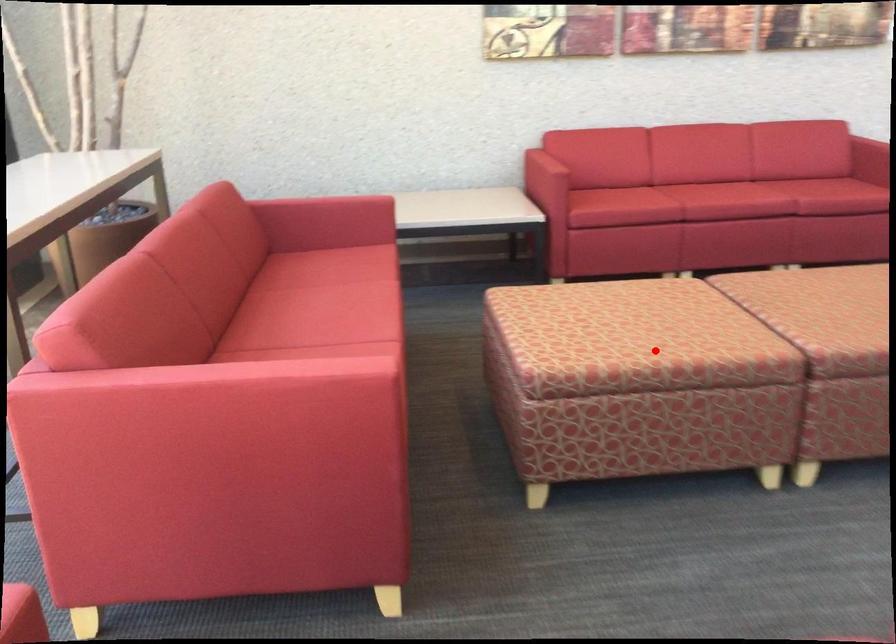
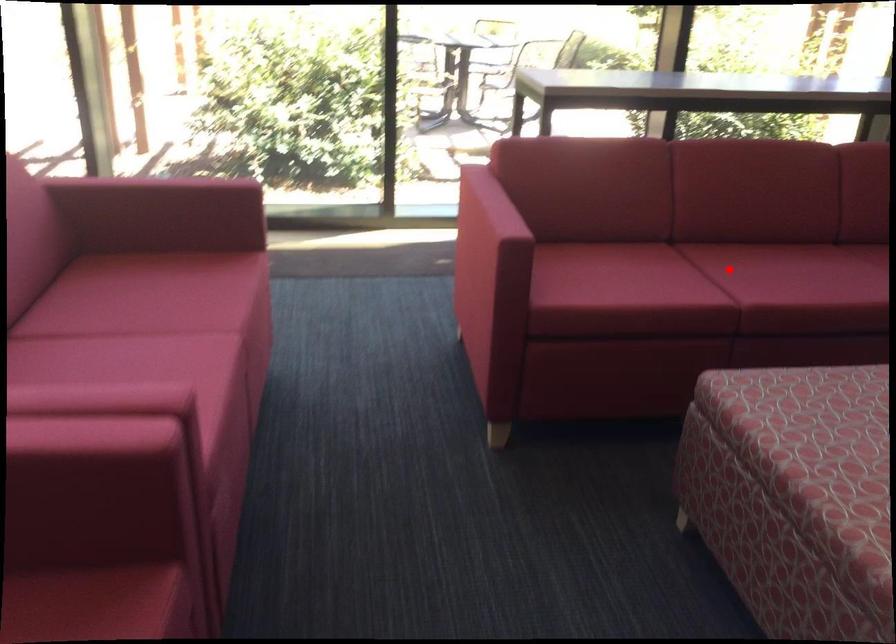
I am providing you with two images of the same scene from different viewpoints. A red point is marked on the first image and another point is marked on the second image. Are the points marked in image1 and image2 representing the same 3D position?

No